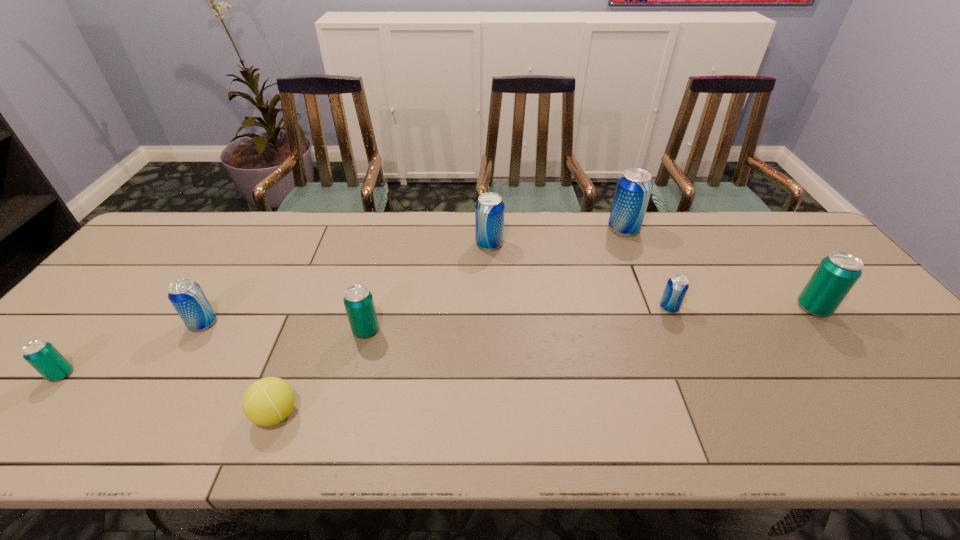
What are the coordinates of `the smallest blue beer can` in the screenshot? It's located at (677, 286).

Where is `the leftmost object`? This screenshot has width=960, height=540. the leftmost object is located at coordinates (41, 355).

You are a GUI agent. You are given a task and a screenshot of the screen. Output one action in this format:
    pyautogui.click(x=<x>, y=<y>)
    Task: Click on the smallest teal beer can
    This screenshot has height=540, width=960.
    Given the screenshot: What is the action you would take?
    pyautogui.click(x=41, y=355)

Locate an element on the screen. green tennis ball is located at coordinates (267, 402).

Find the location of a particular element. the nearest object is located at coordinates pyautogui.click(x=267, y=402).

What are the coordinates of `free region located 0.370m on the front of the biggest blue beer can` in the screenshot? It's located at (663, 326).

You are a GUI agent. You are given a task and a screenshot of the screen. Output one action in this format:
    pyautogui.click(x=<x>, y=<y>)
    Task: Click on the vacant space located 0.340m on the right of the third blue beer can from right to left
    Image resolution: width=960 pixels, height=540 pixels.
    Given the screenshot: What is the action you would take?
    pyautogui.click(x=612, y=244)

Where is `vacant space positioned 0.230m on the back of the biggest teal beer can`? The image size is (960, 540). vacant space positioned 0.230m on the back of the biggest teal beer can is located at coordinates (764, 245).

Where is `vacant space located on the left of the third beer can from left to right`? vacant space located on the left of the third beer can from left to right is located at coordinates (333, 330).

Where is `blank space located on the back of the second beer can from left to right`? blank space located on the back of the second beer can from left to right is located at coordinates (226, 287).